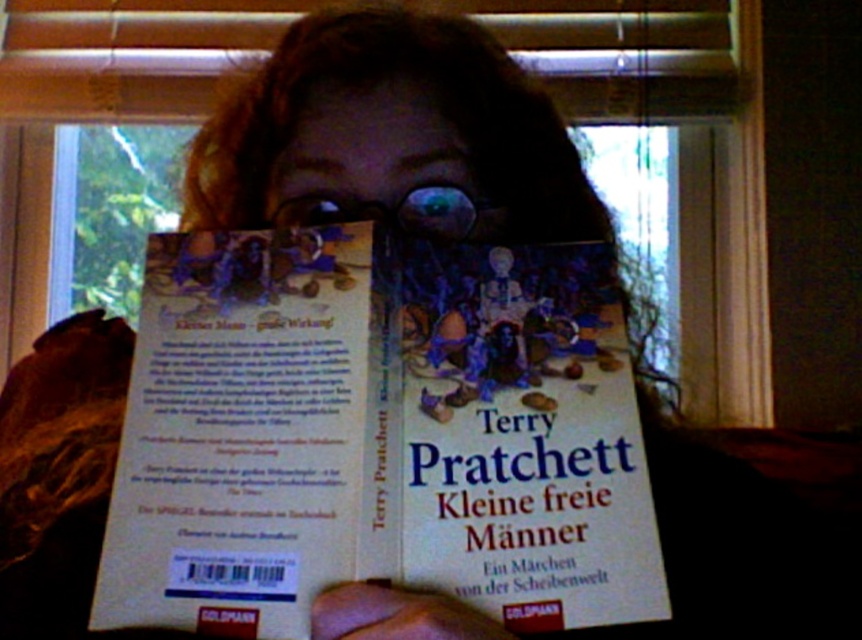
Can you confirm if white paper at center is thinner than matte plastic face at center?

Result: Incorrect, white paper at center's width is not less than matte plastic face at center's.

Which is more to the right, white paper at center or matte plastic face at center?

From the viewer's perspective, matte plastic face at center appears more on the right side.

At what (x,y) coordinates should I click in order to perform the action: click on white paper at center. Please return your answer as a coordinate pair (x, y). The image size is (862, 640). Looking at the image, I should click on (378, 435).

Identify the location of white paper at center. (x=378, y=435).